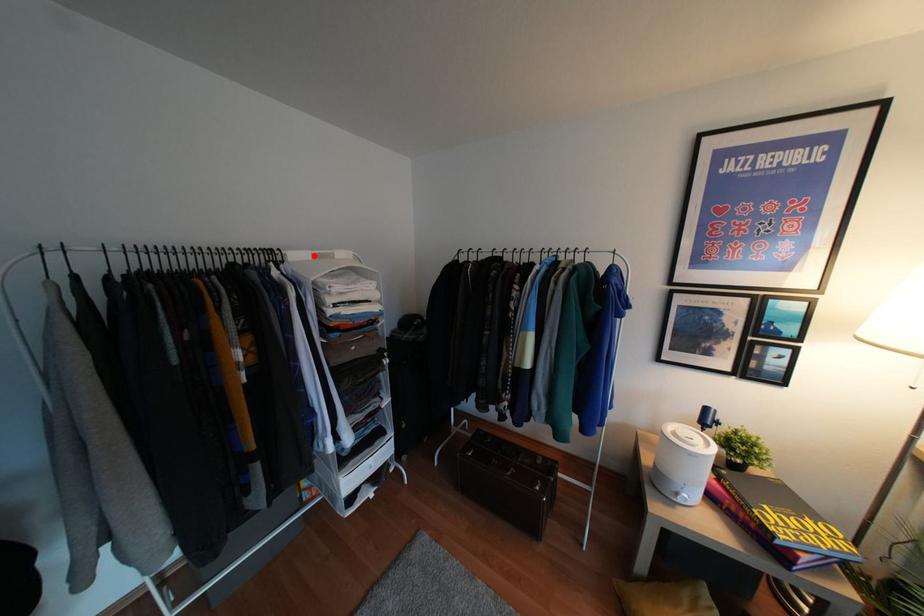
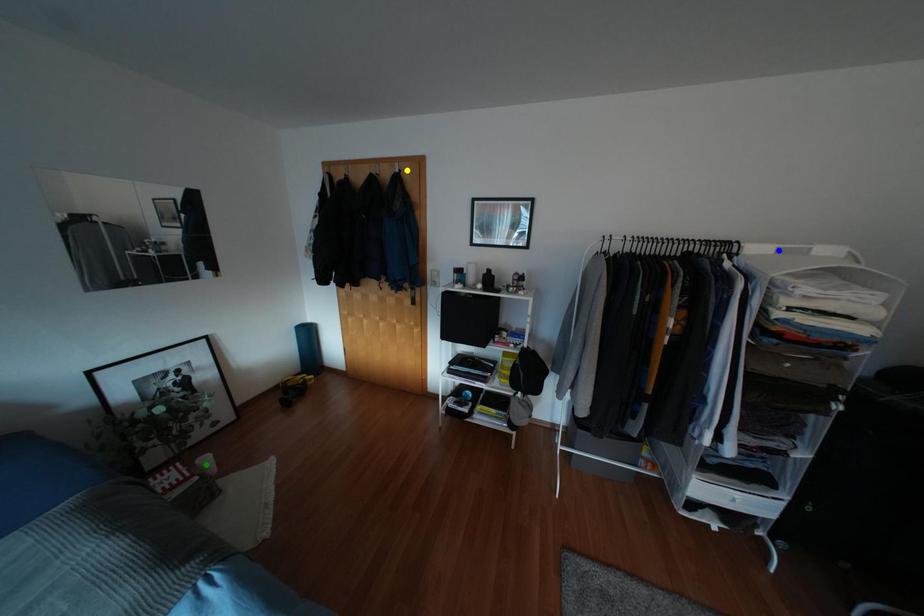
Question: I am providing you with two images of the same scene from different viewpoints. A red point is marked on the first image. You are given multiple points on the second image. Which point in image 2 represents the same 3d spot as the red point in image 1?

Choices:
 (A) blue point
 (B) yellow point
 (C) green point

Answer: (A)